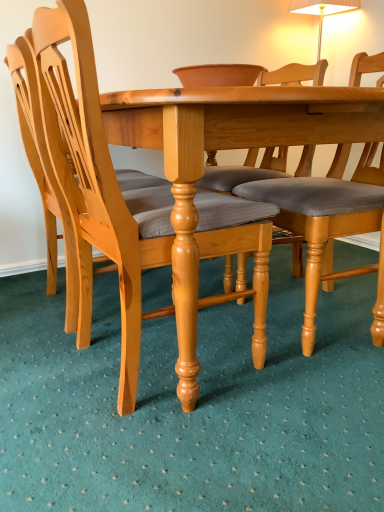
At what (x,y) coordinates should I click in order to perform the action: click on vacant space in front of light brown wood chair at center, the 1th chair viewed from the right. Please return your answer as a coordinate pair (x, y). This screenshot has height=512, width=384. Looking at the image, I should click on (317, 394).